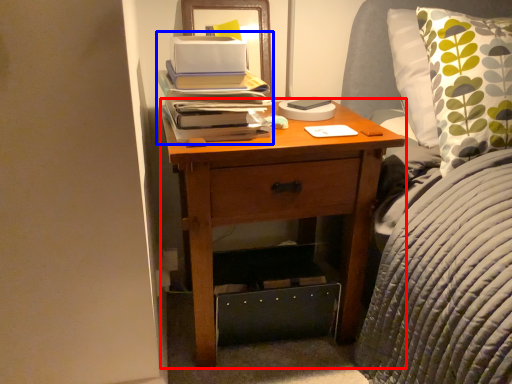
Question: Which of the following is the closest to the observer, nightstand (highlighted by a red box) or book (highlighted by a blue box)?

Choices:
 (A) nightstand
 (B) book

Answer: (A)